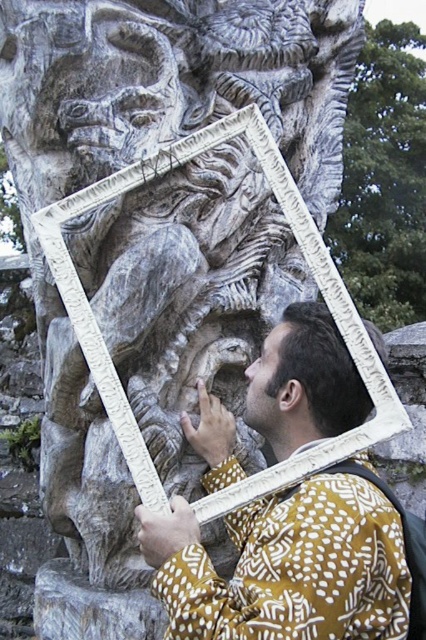
Can you confirm if yellow patterned shirt at center is smaller than green leafy tree at upper right?

Yes.

Describe the element at coordinates (287, 566) in the screenshot. I see `yellow patterned shirt at center` at that location.

This screenshot has height=640, width=426. What are the coordinates of `yellow patterned shirt at center` in the screenshot? It's located at (287, 566).

Describe the element at coordinates (383, 179) in the screenshot. I see `green leafy tree at upper right` at that location.

Looking at this image, which is below, green leafy tree at upper right or matte brown hair at lower right?

matte brown hair at lower right is below.

Locate an element on the screen. This screenshot has width=426, height=640. green leafy tree at upper right is located at coordinates 383,179.

The width and height of the screenshot is (426, 640). What are the coordinates of `green leafy tree at upper right` in the screenshot? It's located at (383, 179).

Between yellow patterned shirt at center and matte brown hair at lower right, which one appears on the right side from the viewer's perspective?

Positioned to the right is matte brown hair at lower right.

Does yellow patterned shirt at center appear under matte brown hair at lower right?

Indeed, yellow patterned shirt at center is positioned under matte brown hair at lower right.

Does point (207, 488) come closer to viewer compared to point (250, 412)?

That is False.

Find the location of a particular element. yellow patterned shirt at center is located at coordinates (287, 566).